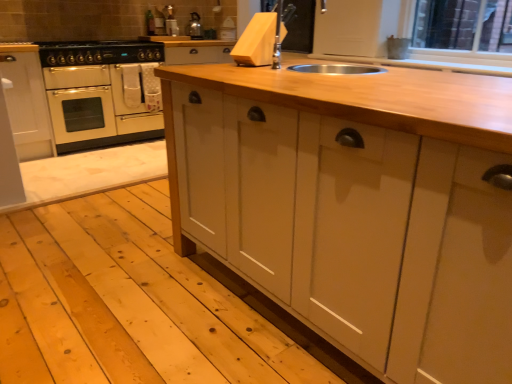
Where is `white matte cabinet at left`? white matte cabinet at left is located at coordinates (27, 101).

Measure the distance between black matte gas stove at upper left and camera.

black matte gas stove at upper left and camera are 11.15 feet apart.

Locate an element on the screen. natural wood countertop at center is located at coordinates (356, 207).

Can you tell me how much metallic silver kettle at upper center and cream matte oven at left differ in facing direction?

metallic silver kettle at upper center and cream matte oven at left are facing 1.3 degrees away from each other.

Which is behind, metallic silver kettle at upper center or cream matte oven at left?

metallic silver kettle at upper center is more distant.

Measure the distance between metallic silver kettle at upper center and cream matte oven at left.

metallic silver kettle at upper center is 3.57 feet away from cream matte oven at left.

Where is `appliance that is above the cream matte oven at left (from a real-world perspective)`? The width and height of the screenshot is (512, 384). appliance that is above the cream matte oven at left (from a real-world perspective) is located at coordinates (170, 22).

Considering the sizes of natural wood countertop at center and cream matte oven at left in the image, is natural wood countertop at center wider or thinner than cream matte oven at left?

Clearly, natural wood countertop at center has more width compared to cream matte oven at left.

Is natural wood countertop at center at the right side of cream matte oven at left?

Yes, natural wood countertop at center is to the right of cream matte oven at left.

Is natural wood countertop at center oriented towards cream matte oven at left?

No, natural wood countertop at center does not turn towards cream matte oven at left.

Which is nearer, (96, 60) or (8, 75)?

Point (96, 60).

At what (x,y) coordinates should I click in order to perform the action: click on cabinetry located underneath the black matte gas stove at upper left (from a real-world perspective). Please return your answer as a coordinate pair (x, y). Looking at the image, I should click on (27, 101).

Looking at this image, between black matte gas stove at upper left and white matte cabinet at left, which one has smaller width?

With smaller width is white matte cabinet at left.

From the image's perspective, which is above, black matte gas stove at upper left or white matte cabinet at left?

black matte gas stove at upper left, from the image's perspective.

Which of these two, cream matte oven at left or natural wood countertop at center, is wider?

natural wood countertop at center is wider.

Could you tell me if cream matte oven at left is turned towards natural wood countertop at center?

Yes, cream matte oven at left faces towards natural wood countertop at center.

Looking at this image, which is more to the left, cream matte oven at left or natural wood countertop at center?

Positioned to the left is cream matte oven at left.

Where is `home appliance lying above the natural wood countertop at center (from the image's perspective)`? The height and width of the screenshot is (384, 512). home appliance lying above the natural wood countertop at center (from the image's perspective) is located at coordinates (101, 92).

From the image's perspective, is metallic silver kettle at upper center above natural wood countertop at center?

Yes, from the image's perspective, metallic silver kettle at upper center is on top of natural wood countertop at center.

Considering the relative sizes of metallic silver kettle at upper center and natural wood countertop at center in the image provided, is metallic silver kettle at upper center thinner than natural wood countertop at center?

Correct, the width of metallic silver kettle at upper center is less than that of natural wood countertop at center.

Choose the correct answer: Is metallic silver kettle at upper center inside natural wood countertop at center or outside it?

metallic silver kettle at upper center is located beyond the bounds of natural wood countertop at center.

Is metallic silver kettle at upper center shorter than natural wood countertop at center?

Indeed, metallic silver kettle at upper center has a lesser height compared to natural wood countertop at center.

Is white matte cabinet at left inside metallic silver kettle at upper center?

No, metallic silver kettle at upper center does not contain white matte cabinet at left.

Can you confirm if metallic silver kettle at upper center is wider than white matte cabinet at left?

No, metallic silver kettle at upper center is not wider than white matte cabinet at left.

Which of these two, metallic silver kettle at upper center or white matte cabinet at left, is bigger?

With larger size is white matte cabinet at left.

Considering the relative sizes of metallic silver kettle at upper center and white matte cabinet at left in the image provided, is metallic silver kettle at upper center shorter than white matte cabinet at left?

Yes, metallic silver kettle at upper center is shorter than white matte cabinet at left.

Which of these two, white matte cabinet at left or metallic silver kettle at upper center, is wider?

Wider between the two is white matte cabinet at left.

Is white matte cabinet at left to the left of metallic silver kettle at upper center from the viewer's perspective?

Correct, you'll find white matte cabinet at left to the left of metallic silver kettle at upper center.

Considering their positions, is white matte cabinet at left located in front of or behind metallic silver kettle at upper center?

white matte cabinet at left is positioned closer to the viewer than metallic silver kettle at upper center.

Would you say white matte cabinet at left contains metallic silver kettle at upper center?

No, white matte cabinet at left does not contain metallic silver kettle at upper center.

In order to click on appliance that is above the cream matte oven at left (from the image's perspective) in this screenshot , I will do `click(170, 22)`.

This screenshot has width=512, height=384. Identify the location of home appliance below the natural wood countertop at center (from a real-world perspective). (101, 92).

Based on their spatial positions, is white matte cabinet at left or cream matte oven at left further from black matte gas stove at upper left?

Among the two, white matte cabinet at left is located further to black matte gas stove at upper left.

From the image, which object appears to be nearer to black matte gas stove at upper left, white matte cabinet at left or metallic silver kettle at upper center?

Based on the image, white matte cabinet at left appears to be nearer to black matte gas stove at upper left.

Estimate the real-world distances between objects in this image. Which object is further from natural wood countertop at center, cream matte oven at left or black matte gas stove at upper left?

Based on the image, black matte gas stove at upper left appears to be further to natural wood countertop at center.

Looking at the image, which one is located closer to cream matte oven at left, natural wood countertop at center or black matte gas stove at upper left?

Based on the image, black matte gas stove at upper left appears to be nearer to cream matte oven at left.

From the image, which object appears to be farther from white matte cabinet at left, natural wood countertop at center or metallic silver kettle at upper center?

natural wood countertop at center.

When comparing their distances from natural wood countertop at center, does black matte gas stove at upper left or cream matte oven at left seem further?

Based on the image, black matte gas stove at upper left appears to be further to natural wood countertop at center.

Which object lies further to the anchor point white matte cabinet at left, natural wood countertop at center or cream matte oven at left?

natural wood countertop at center lies further to white matte cabinet at left than the other object.

Based on their spatial positions, is cream matte oven at left or black matte gas stove at upper left closer to white matte cabinet at left?

cream matte oven at left.

Locate an element on the screen. home appliance positioned between natural wood countertop at center and metallic silver kettle at upper center from near to far is located at coordinates (101, 92).

Locate an element on the screen. home appliance positioned between white matte cabinet at left and metallic silver kettle at upper center from near to far is located at coordinates (101, 92).

The height and width of the screenshot is (384, 512). I want to click on home appliance between black matte gas stove at upper left and metallic silver kettle at upper center along the z-axis, so click(x=101, y=92).

The height and width of the screenshot is (384, 512). Identify the location of cabinetry positioned between natural wood countertop at center and metallic silver kettle at upper center from near to far. (27, 101).